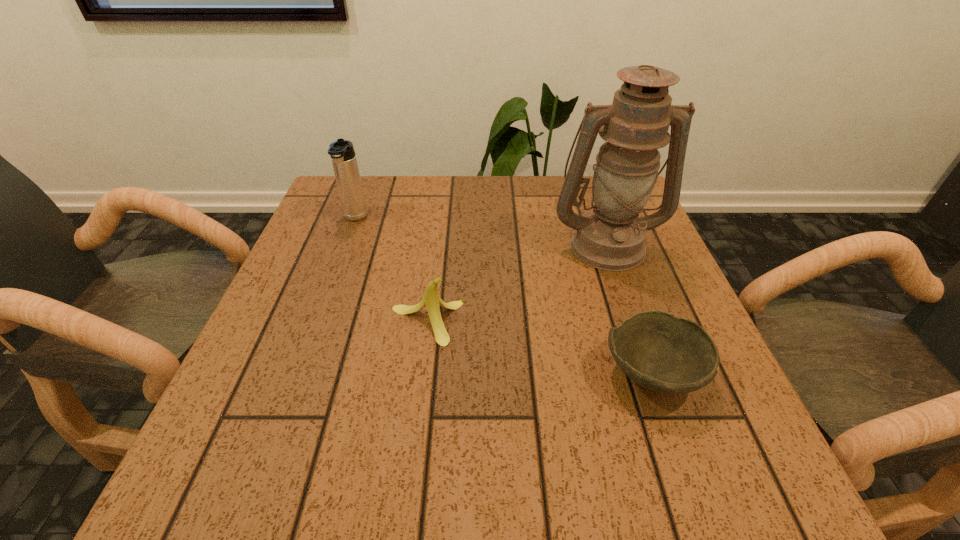
Locate an element on the screen. This screenshot has height=540, width=960. vacant space at the near left corner of the desktop is located at coordinates (235, 454).

I want to click on free point at the near right corner, so click(x=709, y=458).

Find the location of `vacant space in between the bowl and the third shortest object`. vacant space in between the bowl and the third shortest object is located at coordinates (503, 296).

The height and width of the screenshot is (540, 960). I want to click on free space that is in between the oil lamp and the shortest object, so click(629, 309).

Find the location of a particular element. The height and width of the screenshot is (540, 960). free point between the second object from left to right and the tallest object is located at coordinates (517, 284).

Locate an element on the screen. empty space that is in between the shortest object and the thermos bottle is located at coordinates (503, 296).

This screenshot has width=960, height=540. I want to click on free point between the shortest object and the banana, so click(x=540, y=348).

This screenshot has width=960, height=540. What are the coordinates of `free space between the shortest object and the oil lamp` in the screenshot? It's located at (629, 309).

You are a GUI agent. You are given a task and a screenshot of the screen. Output one action in this format:
    pyautogui.click(x=<x>, y=<y>)
    Task: Click on the vacant area that lies between the thermos bottle and the shortest object
    This screenshot has width=960, height=540.
    Given the screenshot: What is the action you would take?
    pyautogui.click(x=503, y=296)

Locate an element on the screen. This screenshot has height=540, width=960. free space between the bowl and the oil lamp is located at coordinates (629, 309).